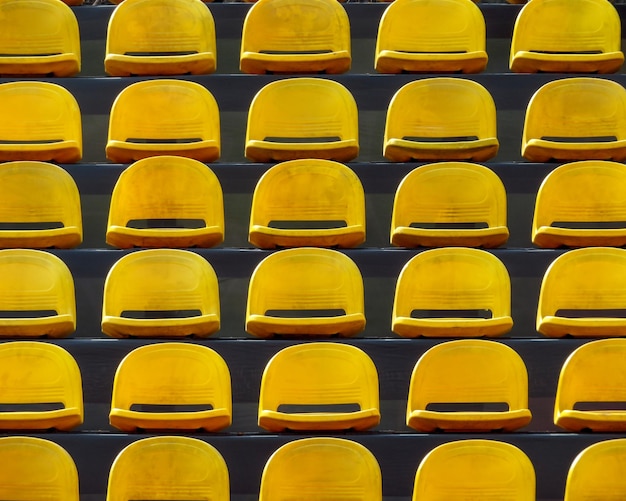
Where is `yellow seats in the middle column`? The width and height of the screenshot is (626, 501). yellow seats in the middle column is located at coordinates (288, 33), (287, 114), (308, 197), (305, 286), (310, 370), (335, 466).